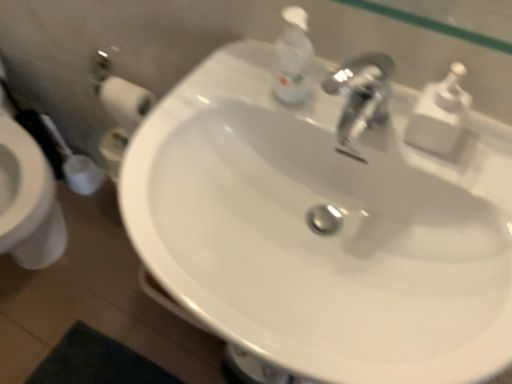
Question: Could you tell me if white glossy sink at center is turned towards white plastic soap dispenser at upper right, the second soap dispenser in the left-to-right sequence?

Choices:
 (A) yes
 (B) no

Answer: (B)

Question: Considering the relative positions of white glossy sink at center and white plastic soap dispenser at upper right, the second soap dispenser in the left-to-right sequence, in the image provided, is white glossy sink at center behind white plastic soap dispenser at upper right, the second soap dispenser in the left-to-right sequence,?

Choices:
 (A) yes
 (B) no

Answer: (B)

Question: Can you confirm if white glossy sink at center is taller than white plastic soap dispenser at upper right, the second soap dispenser in the left-to-right sequence?

Choices:
 (A) no
 (B) yes

Answer: (B)

Question: Is white glossy sink at center at the left side of white plastic soap dispenser at upper right, the second soap dispenser in the left-to-right sequence?

Choices:
 (A) no
 (B) yes

Answer: (B)

Question: From a real-world perspective, is white glossy sink at center positioned over white plastic soap dispenser at upper right, the second soap dispenser in the left-to-right sequence, based on gravity?

Choices:
 (A) yes
 (B) no

Answer: (B)

Question: Do you think white plastic soap dispenser at upper right, the second soap dispenser in the left-to-right sequence, is within white glossy sink at center, or outside of it?

Choices:
 (A) inside
 (B) outside

Answer: (B)

Question: Is white plastic soap dispenser at upper right, the second soap dispenser in the left-to-right sequence, bigger or smaller than white glossy sink at center?

Choices:
 (A) small
 (B) big

Answer: (A)

Question: Is point (434, 84) closer or farther from the camera than point (468, 187)?

Choices:
 (A) farther
 (B) closer

Answer: (A)

Question: From a real-world perspective, relative to white glossy sink at center, is white plastic soap dispenser at upper right, which is the 1th soap dispenser in right-to-left order, vertically above or below?

Choices:
 (A) below
 (B) above

Answer: (B)

Question: In the image, is white plastic soap dispenser at upper center, the first soap dispenser from the left, positioned in front of or behind white plastic soap dispenser at upper right, the second soap dispenser in the left-to-right sequence?

Choices:
 (A) front
 (B) behind

Answer: (B)

Question: Which is correct: white plastic soap dispenser at upper center, the first soap dispenser from the left, is inside white plastic soap dispenser at upper right, the second soap dispenser in the left-to-right sequence, or outside of it?

Choices:
 (A) inside
 (B) outside

Answer: (B)

Question: Considering the relative positions of white plastic soap dispenser at upper center, the first soap dispenser from the left, and white plastic soap dispenser at upper right, which is the 1th soap dispenser in right-to-left order, in the image provided, is white plastic soap dispenser at upper center, the first soap dispenser from the left, to the left or to the right of white plastic soap dispenser at upper right, which is the 1th soap dispenser in right-to-left order,?

Choices:
 (A) left
 (B) right

Answer: (A)

Question: From the image's perspective, is white plastic soap dispenser at upper center, the first soap dispenser from the left, positioned above or below white plastic soap dispenser at upper right, the second soap dispenser in the left-to-right sequence?

Choices:
 (A) above
 (B) below

Answer: (A)

Question: Considering the positions of white glossy sink at center and white plastic soap dispenser at upper right, the second soap dispenser in the left-to-right sequence, in the image, is white glossy sink at center bigger or smaller than white plastic soap dispenser at upper right, the second soap dispenser in the left-to-right sequence,?

Choices:
 (A) big
 (B) small

Answer: (A)

Question: From the image's perspective, is white glossy sink at center located above or below white plastic soap dispenser at upper right, which is the 1th soap dispenser in right-to-left order?

Choices:
 (A) above
 (B) below

Answer: (B)